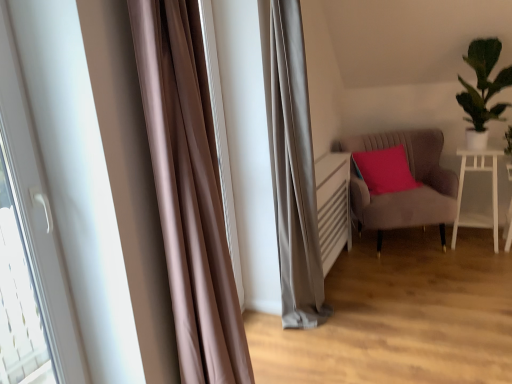
Question: Is white glossy table at right surrounded by suede-like beige armchair at right?

Choices:
 (A) no
 (B) yes

Answer: (A)

Question: From the image's perspective, is suede-like beige armchair at right below white glossy table at right?

Choices:
 (A) no
 (B) yes

Answer: (A)

Question: Is suede-like beige armchair at right to the right of white glossy table at right from the viewer's perspective?

Choices:
 (A) no
 (B) yes

Answer: (A)

Question: Would you say suede-like beige armchair at right is outside white glossy table at right?

Choices:
 (A) no
 (B) yes

Answer: (B)

Question: Is suede-like beige armchair at right thinner than white glossy table at right?

Choices:
 (A) no
 (B) yes

Answer: (A)

Question: From the image's perspective, is white glossy table at right positioned above or below suede-like beige armchair at right?

Choices:
 (A) below
 (B) above

Answer: (A)

Question: In the image, is white glossy table at right positioned in front of or behind suede-like beige armchair at right?

Choices:
 (A) front
 (B) behind

Answer: (B)

Question: In terms of width, does white glossy table at right look wider or thinner when compared to suede-like beige armchair at right?

Choices:
 (A) thin
 (B) wide

Answer: (A)

Question: Is white glossy table at right taller or shorter than suede-like beige armchair at right?

Choices:
 (A) short
 (B) tall

Answer: (A)

Question: From a real-world perspective, relative to white glossy table at right, is suede-like beige armchair at right vertically above or below?

Choices:
 (A) above
 (B) below

Answer: (A)

Question: Considering the positions of suede-like beige armchair at right and white glossy table at right in the image, is suede-like beige armchair at right taller or shorter than white glossy table at right?

Choices:
 (A) short
 (B) tall

Answer: (B)

Question: From the image's perspective, is suede-like beige armchair at right positioned above or below white glossy table at right?

Choices:
 (A) below
 (B) above

Answer: (B)

Question: In terms of size, does suede-like beige armchair at right appear bigger or smaller than white glossy table at right?

Choices:
 (A) big
 (B) small

Answer: (A)

Question: From the image's perspective, relative to green leafy plant at upper right, is white glossy table at right above or below?

Choices:
 (A) above
 (B) below

Answer: (B)

Question: Is white glossy table at right inside or outside of green leafy plant at upper right?

Choices:
 (A) inside
 (B) outside

Answer: (B)